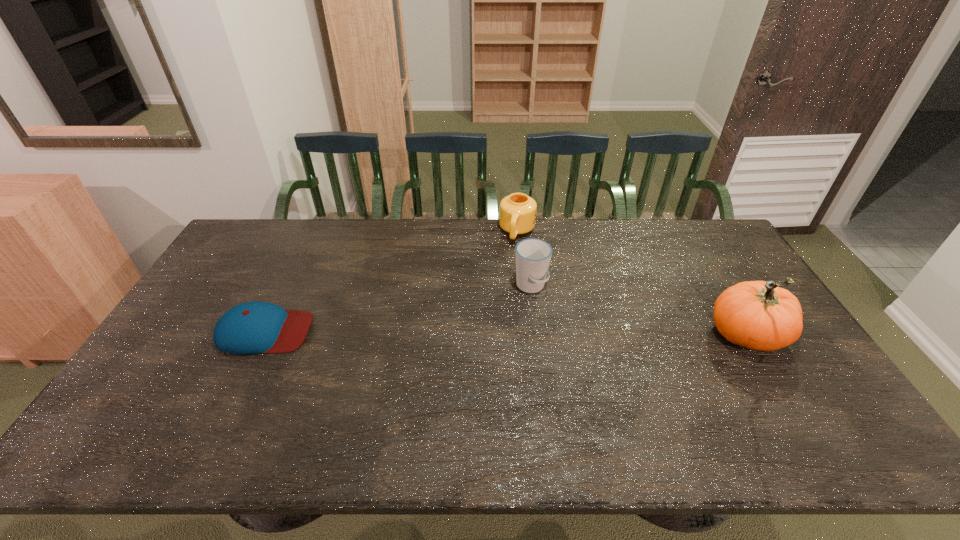
Where is `vacant space at the right edge`? The width and height of the screenshot is (960, 540). vacant space at the right edge is located at coordinates (706, 261).

In the image, there is a desktop. What are the coordinates of `vacant region at the far left corner` in the screenshot? It's located at (247, 242).

You are a GUI agent. You are given a task and a screenshot of the screen. Output one action in this format:
    pyautogui.click(x=<x>, y=<y>)
    Task: Click on the vacant space at the near left corner of the desktop
    This screenshot has height=540, width=960.
    Given the screenshot: What is the action you would take?
    pyautogui.click(x=121, y=415)

At what (x,y) coordinates should I click in order to perform the action: click on free space at the far right corner. Please return your answer as a coordinate pair (x, y). Looking at the image, I should click on (708, 235).

The image size is (960, 540). In order to click on unoccupied area between the tallest object and the farthest object in this screenshot , I will do `click(633, 284)`.

The image size is (960, 540). What are the coordinates of `empty space between the rightmost object and the mug` in the screenshot? It's located at (633, 284).

Find the location of a particular element. The height and width of the screenshot is (540, 960). vacant region between the mug and the baseball cap is located at coordinates (391, 281).

This screenshot has height=540, width=960. What are the coordinates of `free area in between the cup and the tallest object` in the screenshot? It's located at (639, 311).

Identify the location of free spot between the baseball cap and the cup. (397, 309).

I want to click on blank region between the rightmost object and the baseball cap, so click(506, 334).